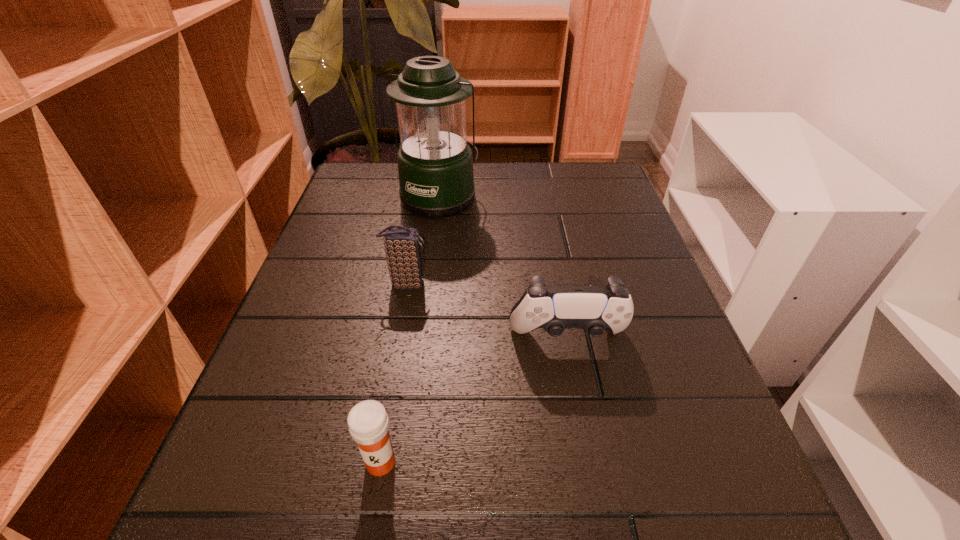
Where is `lantern`? lantern is located at coordinates (435, 165).

Locate an element on the screen. the farthest object is located at coordinates (435, 165).

This screenshot has width=960, height=540. I want to click on the second farthest object, so click(x=402, y=245).

The image size is (960, 540). Identify the location of the third farthest object. (609, 307).

This screenshot has height=540, width=960. Find the location of `control`. control is located at coordinates (609, 307).

At what (x,y) coordinates should I click in order to perform the action: click on the nearest object. Please return your answer as a coordinate pair (x, y). Looking at the image, I should click on (368, 422).

I want to click on vacant position located on the right of the tallest object, so click(621, 197).

This screenshot has width=960, height=540. Find the location of `free region located 0.190m with the zip open on the third nearest object`. free region located 0.190m with the zip open on the third nearest object is located at coordinates (523, 284).

The image size is (960, 540). Identify the location of free space located on the front-facing side of the control. (580, 407).

You are a GUI agent. You are given a task and a screenshot of the screen. Output one action in this format:
    pyautogui.click(x=<x>, y=<y>)
    Task: Click on the object present at the far edge
    
    Given the screenshot: What is the action you would take?
    tap(435, 165)